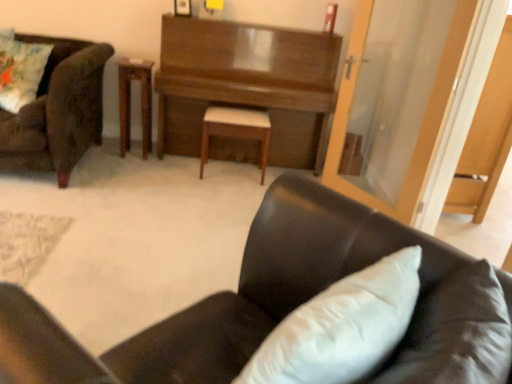
This screenshot has width=512, height=384. I want to click on free space in front of wooden table at center, so click(124, 166).